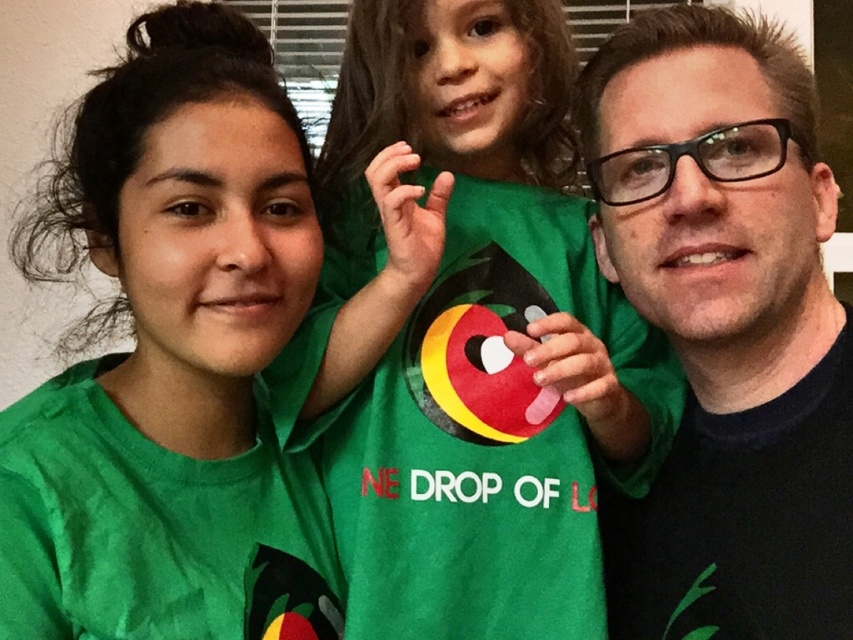
Question: Which object appears closest to the camera in this image?

Choices:
 (A) green matte shirt at center
 (B) black matte shirt at center

Answer: (B)

Question: Can you confirm if green matte shirt at center is smaller than green matte shirt at upper center?

Choices:
 (A) no
 (B) yes

Answer: (A)

Question: Is green matte shirt at center to the left of black matte shirt at center from the viewer's perspective?

Choices:
 (A) no
 (B) yes

Answer: (B)

Question: Which point is closer to the camera?

Choices:
 (A) (148, 204)
 (B) (395, 442)
 (C) (781, 236)

Answer: (A)

Question: Is green matte shirt at center bigger than black matte shirt at center?

Choices:
 (A) no
 (B) yes

Answer: (B)

Question: Which object is the closest to the black matte shirt at center?

Choices:
 (A) green matte shirt at center
 (B) green matte shirt at upper center

Answer: (A)